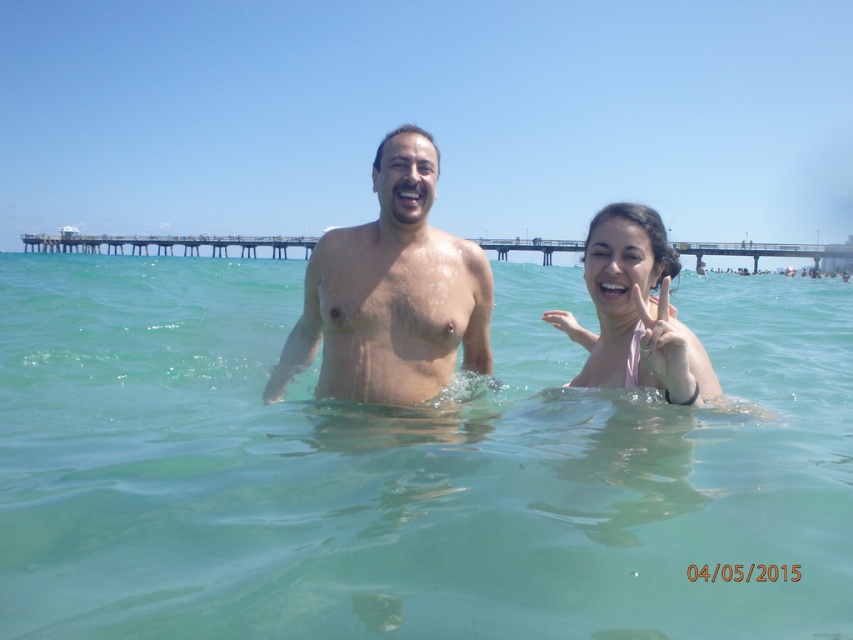
Question: Which of these objects is positioned closest to the pink fabric at right?

Choices:
 (A) smooth skin man at center
 (B) clear water at center

Answer: (A)

Question: Does smooth skin man at center appear on the right side of wooden pier at upper center?

Choices:
 (A) no
 (B) yes

Answer: (B)

Question: Can you confirm if clear water at center is positioned above wooden pier at upper center?

Choices:
 (A) yes
 (B) no

Answer: (B)

Question: In this image, where is clear water at center located relative to pink fabric at right?

Choices:
 (A) below
 (B) above

Answer: (B)

Question: Estimate the real-world distances between objects in this image. Which object is farther from the wooden pier at upper center?

Choices:
 (A) clear water at center
 (B) pink fabric at right
 (C) smooth skin man at center

Answer: (A)

Question: Based on their relative distances, which object is nearer to the clear water at center?

Choices:
 (A) pink fabric at right
 (B) wooden pier at upper center

Answer: (A)